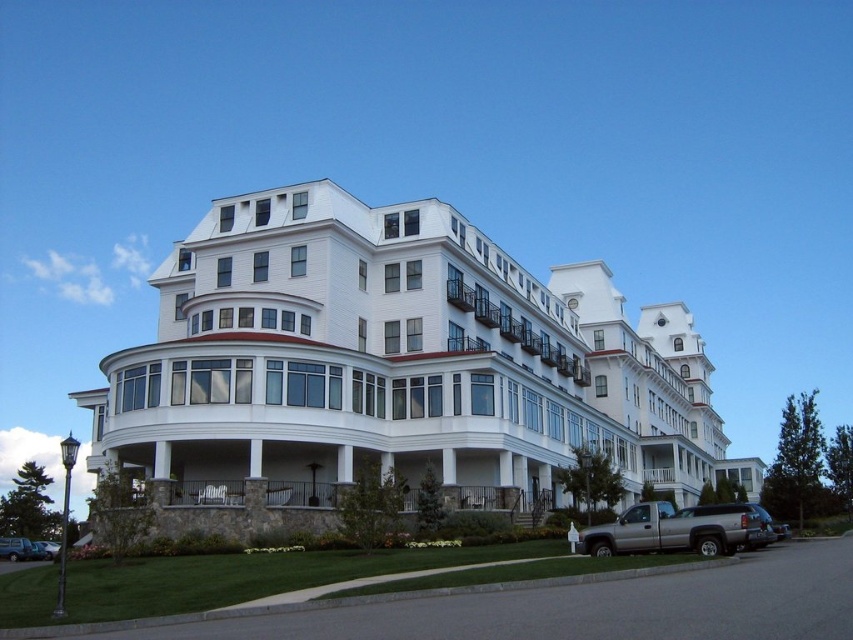
From the picture: Is silver metallic truck at lower right bigger than metallic silver car at lower left?

Yes.

Who is taller, silver metallic truck at lower right or metallic silver car at lower left?

Standing taller between the two is silver metallic truck at lower right.

Does point (767, 524) come farther from viewer compared to point (54, 541)?

No, it is in front of (54, 541).

Locate an element on the screen. silver metallic truck at lower right is located at coordinates (735, 512).

Does white painted wood balcony at center have a lesser width compared to metallic silver car at lower left?

Correct, white painted wood balcony at center's width is less than metallic silver car at lower left's.

Can you confirm if white painted wood balcony at center is positioned below metallic silver car at lower left?

Incorrect, white painted wood balcony at center is not positioned below metallic silver car at lower left.

Which is in front, point (474, 307) or point (35, 548)?

Point (35, 548) is more forward.

Identify the location of white painted wood balcony at center. This screenshot has height=640, width=853. (515, 330).

Does silver metallic truck at lower right appear under metallic silver suv at lower left?

Incorrect, silver metallic truck at lower right is not positioned below metallic silver suv at lower left.

Does point (759, 509) come closer to viewer compared to point (44, 552)?

Yes, point (759, 509) is closer to viewer.

You are a GUI agent. You are given a task and a screenshot of the screen. Output one action in this format:
    pyautogui.click(x=<x>, y=<y>)
    Task: Click on the silver metallic truck at lower right
    The image size is (853, 640).
    Given the screenshot: What is the action you would take?
    pyautogui.click(x=735, y=512)